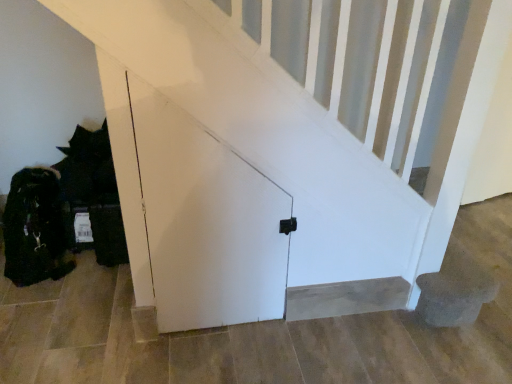
Question: From a real-world perspective, relative to smooth beige carpet at lower center, is white matte door at center vertically above or below?

Choices:
 (A) above
 (B) below

Answer: (A)

Question: Is point (234, 220) closer or farther from the camera than point (288, 294)?

Choices:
 (A) farther
 (B) closer

Answer: (B)

Question: From the image's perspective, is white matte door at center located above or below smooth beige carpet at lower center?

Choices:
 (A) above
 (B) below

Answer: (A)

Question: Considering the positions of smooth beige carpet at lower center and white matte door at center in the image, is smooth beige carpet at lower center bigger or smaller than white matte door at center?

Choices:
 (A) small
 (B) big

Answer: (A)

Question: From a real-world perspective, relative to white matte door at center, is smooth beige carpet at lower center vertically above or below?

Choices:
 (A) above
 (B) below

Answer: (B)

Question: Is smooth beige carpet at lower center spatially inside white matte door at center, or outside of it?

Choices:
 (A) outside
 (B) inside

Answer: (A)

Question: Visually, is smooth beige carpet at lower center positioned to the left or to the right of white matte door at center?

Choices:
 (A) left
 (B) right

Answer: (B)